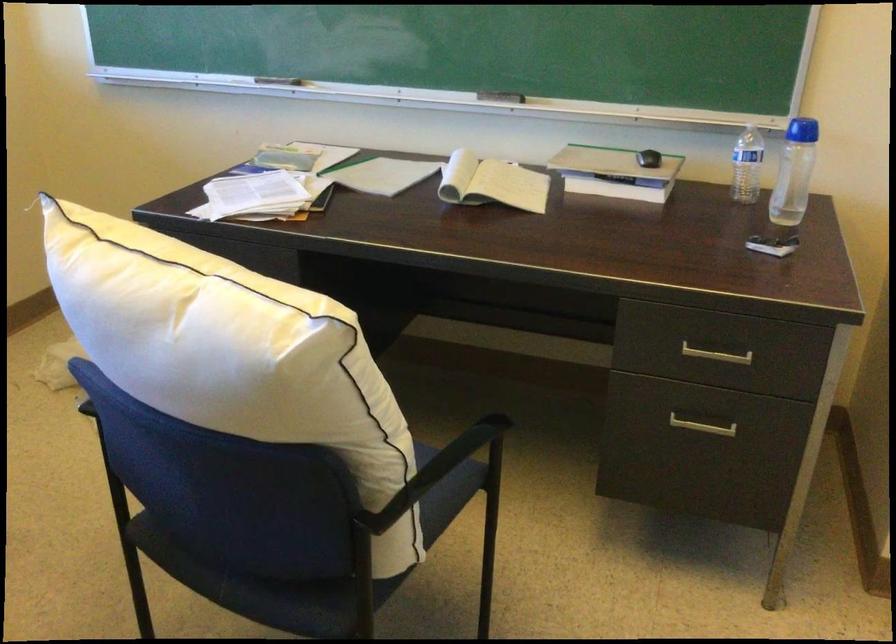
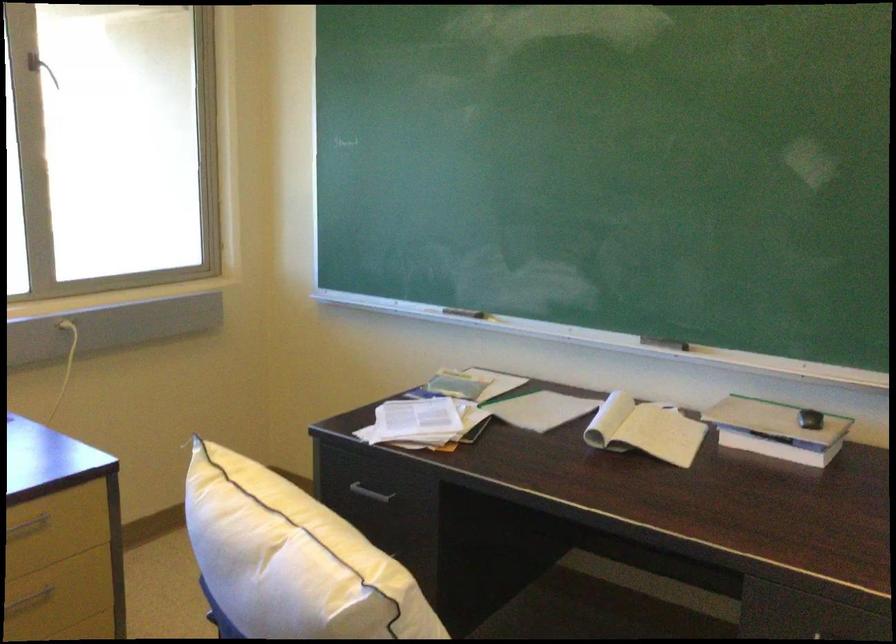
Question: I am providing you with two images of the same scene from different viewpoints. Which of the following objects are not visible in image2?

Choices:
 (A) open spiral notebook
 (B) white pillow
 (C) black computer mouse
 (D) none of these

Answer: (D)